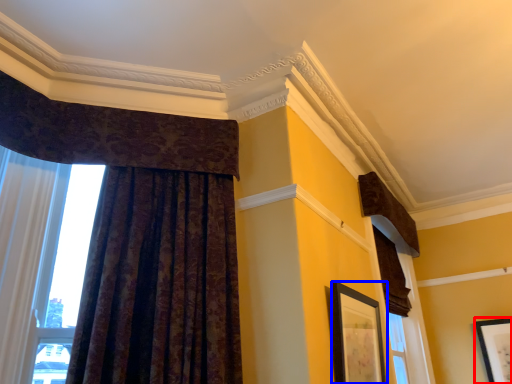
Question: Which object appears closest to the camera in this image, picture frame (highlighted by a red box) or picture frame (highlighted by a blue box)?

Choices:
 (A) picture frame
 (B) picture frame

Answer: (B)